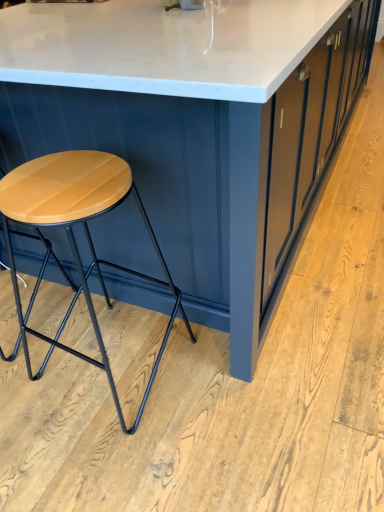
Question: Is white marble table at center behind wooden matte stool at left?

Choices:
 (A) yes
 (B) no

Answer: (B)

Question: Considering the relative sizes of white marble table at center and wooden matte stool at left in the image provided, is white marble table at center smaller than wooden matte stool at left?

Choices:
 (A) no
 (B) yes

Answer: (A)

Question: Is white marble table at center to the left of wooden matte stool at left from the viewer's perspective?

Choices:
 (A) no
 (B) yes

Answer: (A)

Question: From a real-world perspective, is white marble table at center over wooden matte stool at left?

Choices:
 (A) yes
 (B) no

Answer: (A)

Question: From the image's perspective, is white marble table at center above wooden matte stool at left?

Choices:
 (A) yes
 (B) no

Answer: (A)

Question: Can you confirm if white marble table at center is bigger than wooden matte stool at left?

Choices:
 (A) yes
 (B) no

Answer: (A)

Question: From the image's perspective, is wooden matte stool at left beneath white marble table at center?

Choices:
 (A) yes
 (B) no

Answer: (A)

Question: Can you confirm if wooden matte stool at left is positioned to the right of white marble table at center?

Choices:
 (A) yes
 (B) no

Answer: (B)

Question: Is wooden matte stool at left surrounding white marble table at center?

Choices:
 (A) yes
 (B) no

Answer: (B)

Question: Is wooden matte stool at left bigger than white marble table at center?

Choices:
 (A) no
 (B) yes

Answer: (A)

Question: Is wooden matte stool at left to the left of white marble table at center from the viewer's perspective?

Choices:
 (A) no
 (B) yes

Answer: (B)

Question: Can you confirm if wooden matte stool at left is taller than white marble table at center?

Choices:
 (A) no
 (B) yes

Answer: (A)

Question: From the image's perspective, is wooden matte stool at left above or below white marble table at center?

Choices:
 (A) below
 (B) above

Answer: (A)